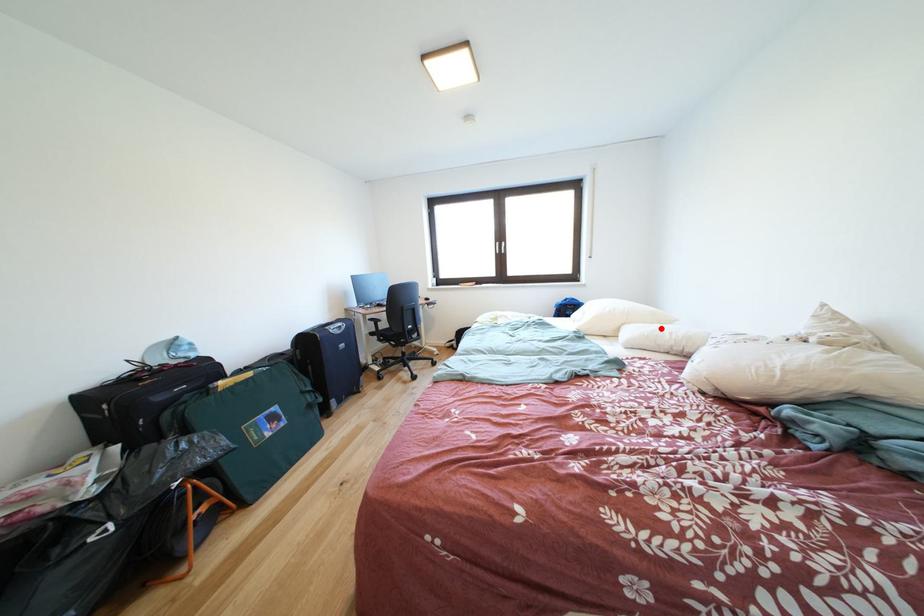
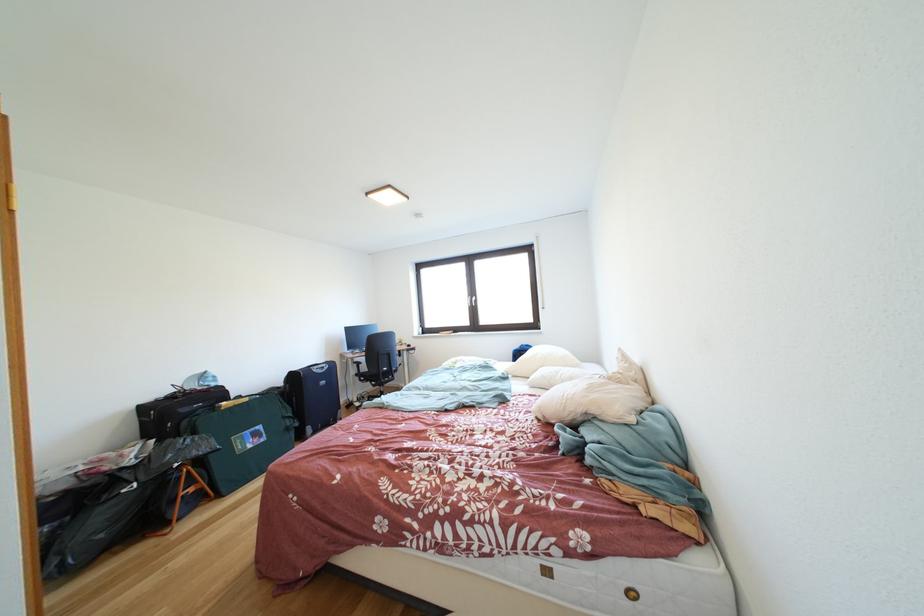
Question: I am providing you with two images of the same scene from different viewpoints. In image1, a red point is highlighted. Considering the same 3D point in image2, which of the following is correct?

Choices:
 (A) It is closer
 (B) It is farther

Answer: (B)